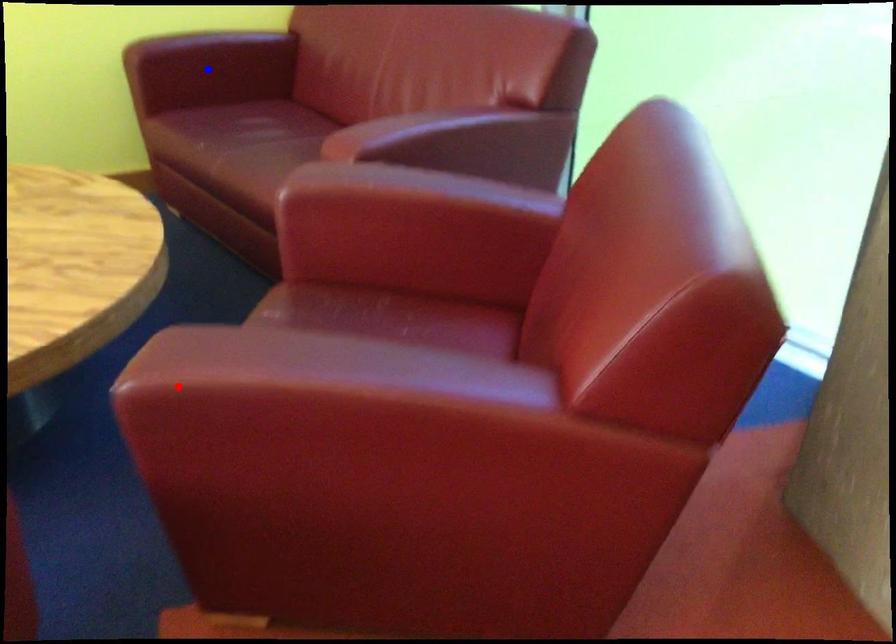
Question: In the image, two points are highlighted. Which point is nearer to the camera? Reply with the corresponding letter.

Choices:
 (A) blue point
 (B) red point

Answer: (B)